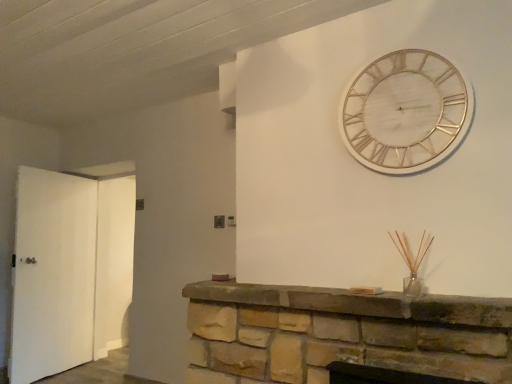
Question: From the image's perspective, does white matte door at left, which is the second door from right to left, appear higher than brown stone fireplace at center?

Choices:
 (A) yes
 (B) no

Answer: (B)

Question: Is white matte door at left, which is counted as the 1th door, starting from the left, not near brown stone fireplace at center?

Choices:
 (A) no
 (B) yes

Answer: (B)

Question: Is white matte door at left, which is counted as the 1th door, starting from the left, taller than brown stone fireplace at center?

Choices:
 (A) yes
 (B) no

Answer: (A)

Question: Could you tell me if white matte door at left, which is the second door from right to left, is facing brown stone fireplace at center?

Choices:
 (A) no
 (B) yes

Answer: (B)

Question: From a real-world perspective, is white matte door at left, which is counted as the 1th door, starting from the left, positioned over brown stone fireplace at center based on gravity?

Choices:
 (A) yes
 (B) no

Answer: (A)

Question: Is white matte door at left, which is counted as the 1th door, starting from the left, not within brown stone fireplace at center?

Choices:
 (A) yes
 (B) no

Answer: (A)

Question: Is brown stone fireplace at center thinner than white wood wall clock at upper right?

Choices:
 (A) no
 (B) yes

Answer: (A)

Question: From a real-world perspective, is brown stone fireplace at center on white wood wall clock at upper right?

Choices:
 (A) yes
 (B) no

Answer: (B)

Question: Can you confirm if brown stone fireplace at center is shorter than white wood wall clock at upper right?

Choices:
 (A) no
 (B) yes

Answer: (B)

Question: Is there a large distance between brown stone fireplace at center and white wood wall clock at upper right?

Choices:
 (A) yes
 (B) no

Answer: (B)

Question: Is white wood wall clock at upper right completely or partially inside brown stone fireplace at center?

Choices:
 (A) yes
 (B) no

Answer: (B)

Question: Considering the relative sizes of brown stone fireplace at center and white wood wall clock at upper right in the image provided, is brown stone fireplace at center taller than white wood wall clock at upper right?

Choices:
 (A) yes
 (B) no

Answer: (B)

Question: From a real-world perspective, is white matte door at left, which is counted as the 1th door, starting from the left, below white matte door at left, arranged as the second door when viewed from the left?

Choices:
 (A) yes
 (B) no

Answer: (A)